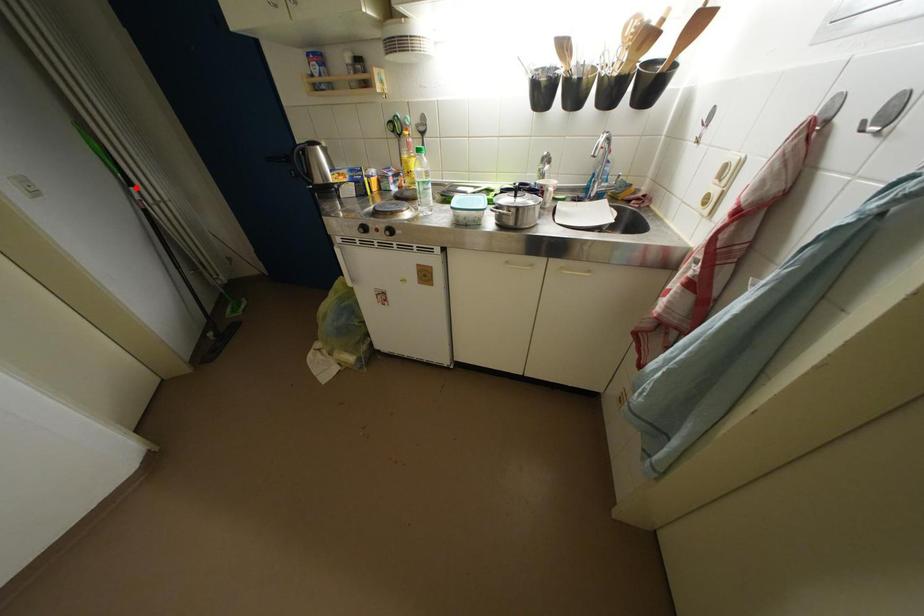
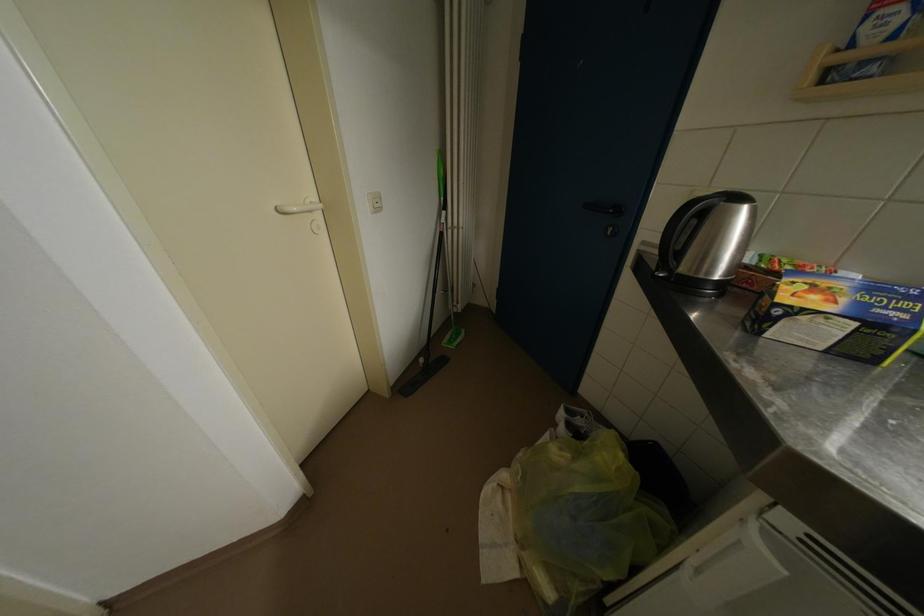
In the second image, find the point that corresponds to the highlighted location in the first image.

(451, 211)